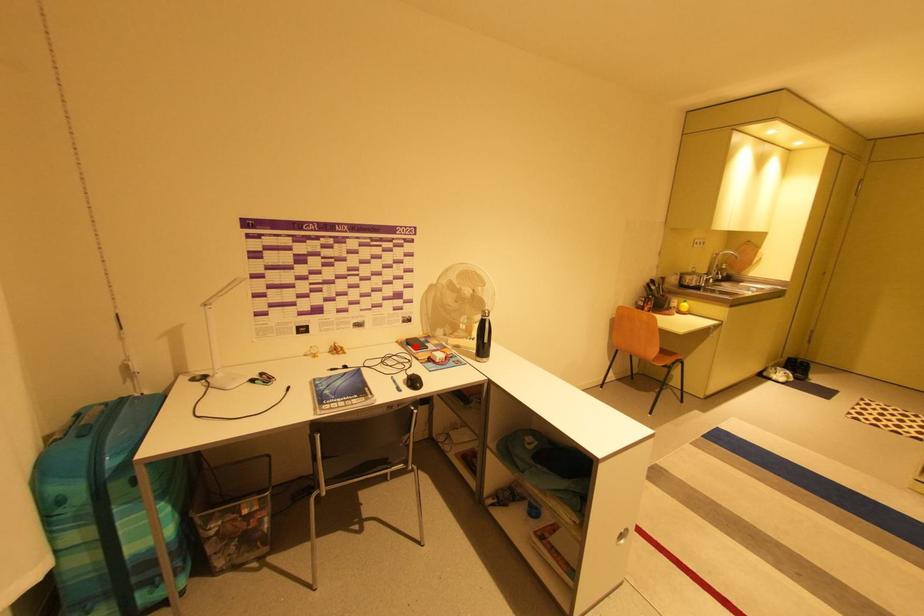
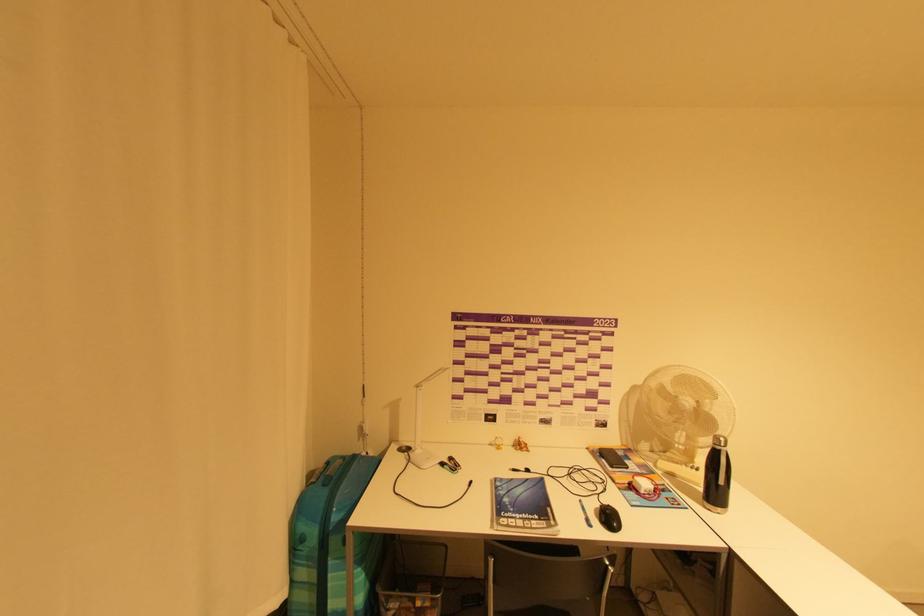
Locate, in the second image, the point that corresponds to the highlighted location in the first image.

(609, 460)